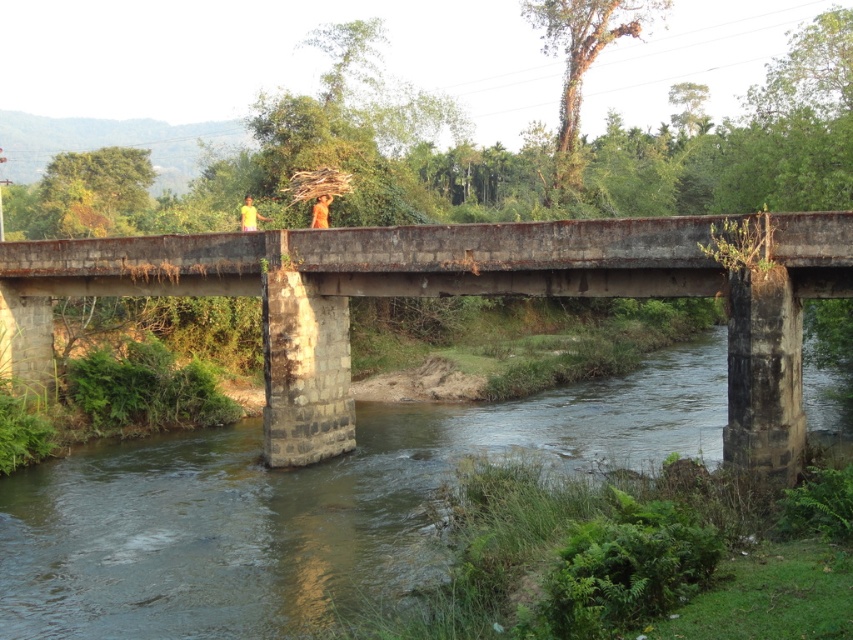
Question: Which is nearer to the rusty concrete bridge at center?

Choices:
 (A) brown concrete river at center
 (B) orange fabric monk at center

Answer: (A)

Question: Does yellow fabric monk at center have a greater width compared to orange fabric monk at center?

Choices:
 (A) no
 (B) yes

Answer: (B)

Question: Which of the following is the farthest from the observer?

Choices:
 (A) (247, 220)
 (B) (271, 588)
 (C) (318, 209)
 (D) (268, 433)

Answer: (C)

Question: Where is brown concrete river at center located in relation to rusty concrete bridge at center in the image?

Choices:
 (A) right
 (B) left

Answer: (A)

Question: Does brown concrete river at center appear on the right side of rusty concrete bridge at center?

Choices:
 (A) yes
 (B) no

Answer: (A)

Question: Which of the following is the closest to the observer?

Choices:
 (A) yellow fabric monk at center
 (B) rusty concrete bridge at center
 (C) orange fabric monk at center
 (D) brown concrete river at center

Answer: (D)